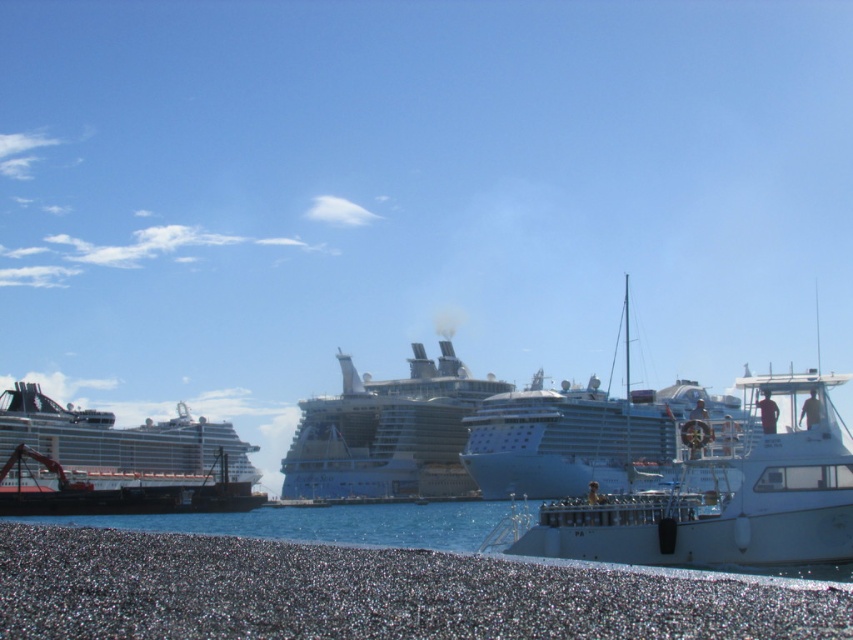
You are standing on the cruise ship docked at the pier and looking towards the lower left corner of the image. What type of surface do you see at the point marked by coordinates (370, 593)?

The point at coordinates (370, 593) indicates smooth pebbles at lower left.

In the scene shown: You are standing on the smooth pebbles at lower left and looking towards the silver metallic cruise ship at center. Which object is closer to the horizon?

The silver metallic cruise ship at center is closer to the horizon than the smooth pebbles at lower left because the smooth pebbles at lower left has a lesser height compared to silver metallic cruise ship at center.

You are standing on the pier and want to walk towards the cruise ship. There are two points marked on the pier at coordinates point (399, 547) and point (344, 432). Which point should you step on first to ensure you are moving towards the cruise ship?

You should step on point (399, 547) first because it is in front of point (344, 432), meaning it is closer to the cruise ship and on the correct path towards it.